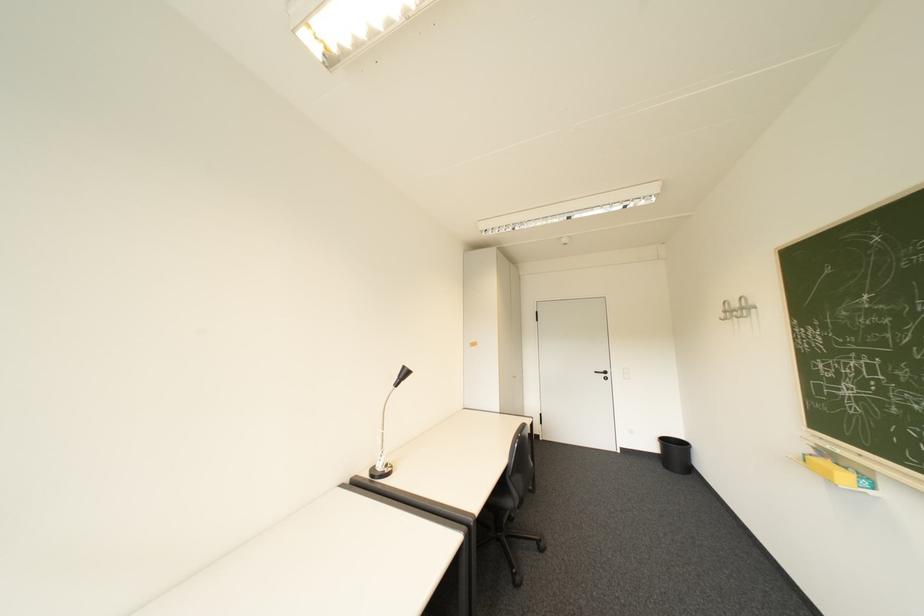
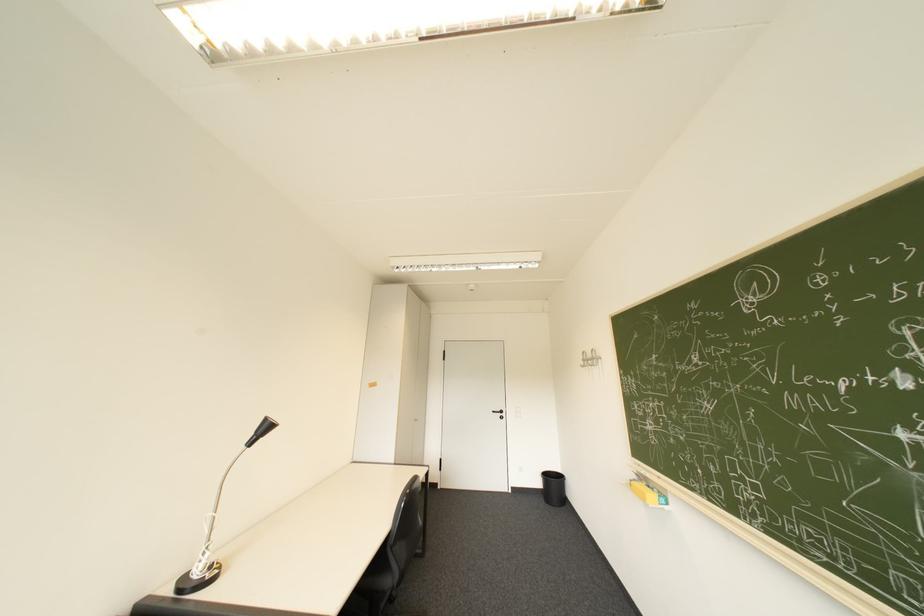
In the second image, find the point that corresponds to the point at 671,467 in the first image.

(553, 501)